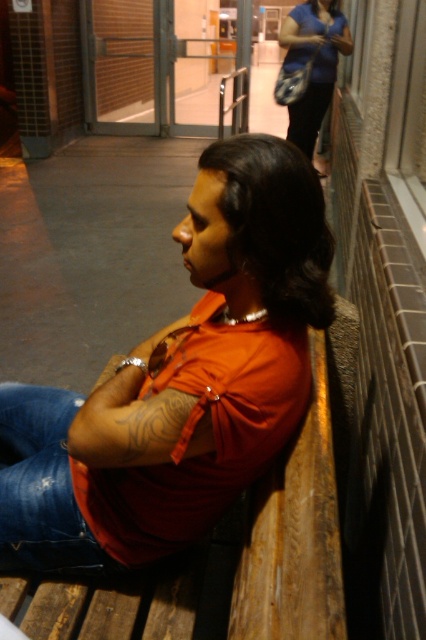
You are designing a new uniform for the staff and need to ensure that the orange shirt fits over the blue jeans. Based on the scene, will the matte orange shirt at center cover the blue denim jeans at lower left when worn?

The matte orange shirt at center is wider than the blue denim jeans at lower left, so the orange shirt should cover the jeans when worn.

You are a fashion designer observing the scene. You need to determine which clothing item, the matte orange shirt at center or the blue denim jeans at lower left, would require more fabric to produce. Based on the description, which one would need more fabric?

The matte orange shirt at center is larger in size than the blue denim jeans at lower left, so it would require more fabric to produce.